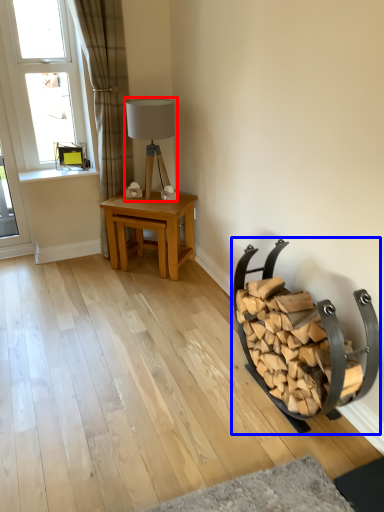
Question: Which object appears farthest to the camera in this image, table lamp (highlighted by a red box) or rocking chair (highlighted by a blue box)?

Choices:
 (A) table lamp
 (B) rocking chair

Answer: (A)